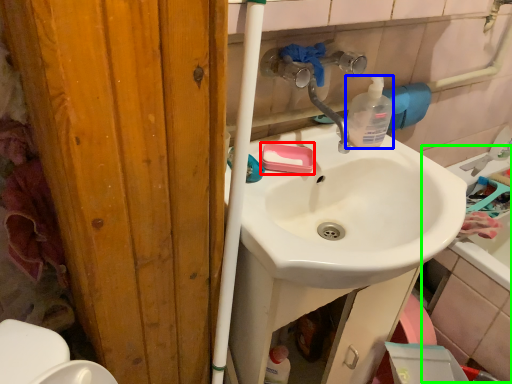
Question: Estimate the real-world distances between objects in this image. Which object is farther from soap (highlighted by a red box), bottle (highlighted by a blue box) or bath (highlighted by a green box)?

Choices:
 (A) bottle
 (B) bath

Answer: (B)